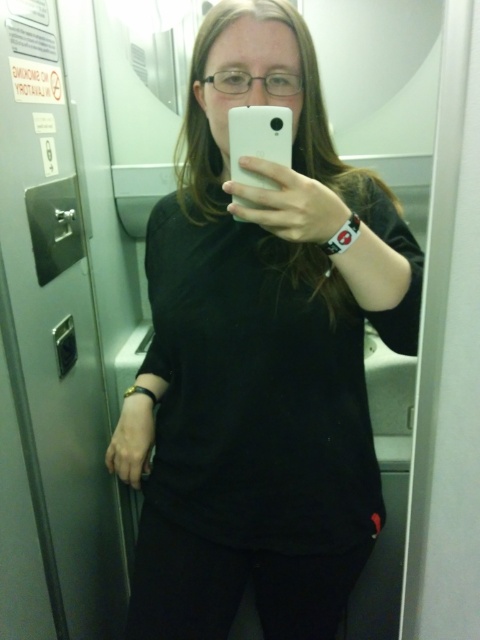
Question: Does black matte shirt at center lie behind white matte phone at center?

Choices:
 (A) yes
 (B) no

Answer: (B)

Question: Can you confirm if black matte shirt at center is wider than white matte phone at center?

Choices:
 (A) no
 (B) yes

Answer: (B)

Question: Which point is farther to the camera?

Choices:
 (A) (342, 202)
 (B) (283, 136)

Answer: (A)

Question: Is black matte shirt at center below white matte phone at center?

Choices:
 (A) no
 (B) yes

Answer: (B)

Question: Which of the following is the farthest from the observer?

Choices:
 (A) (248, 52)
 (B) (285, 124)

Answer: (A)